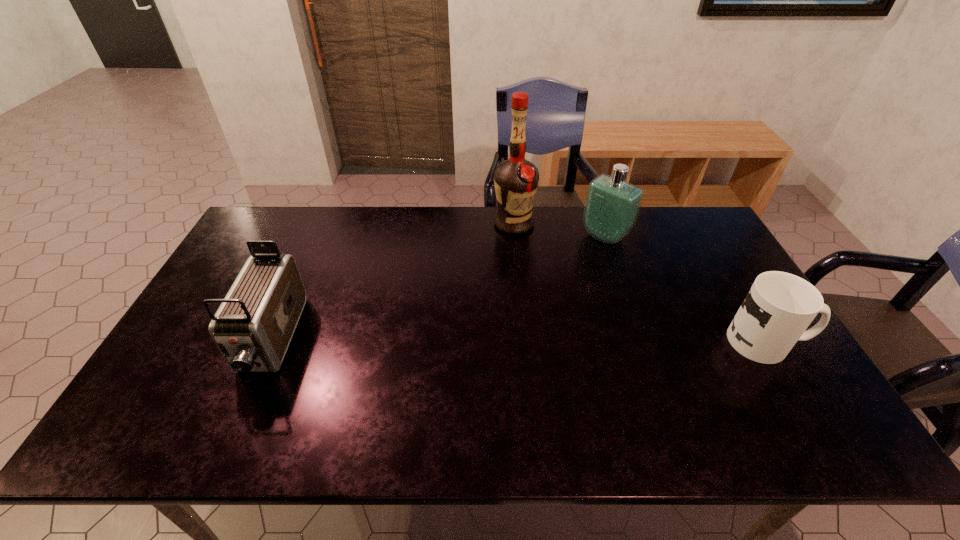
Identify the location of blank space located 0.290m on the front and back of the third object from right to left. (540, 296).

At what (x,y) coordinates should I click in order to perform the action: click on free region located on the front and back of the third object from right to left. Please return your answer as a coordinate pair (x, y). Image resolution: width=960 pixels, height=540 pixels. Looking at the image, I should click on (540, 298).

Where is `perfume situated at the far edge`? perfume situated at the far edge is located at coordinates (612, 205).

The image size is (960, 540). Identify the location of liquor that is positioned at the far edge. (516, 180).

In order to click on object present at the near edge in this screenshot , I will do `click(253, 327)`.

I want to click on object located at the right edge, so click(779, 307).

Find the location of `free space at the far edge`. free space at the far edge is located at coordinates (532, 235).

Image resolution: width=960 pixels, height=540 pixels. In the image, there is a desktop. In order to click on vacant space at the near edge in this screenshot , I will do `click(551, 388)`.

Image resolution: width=960 pixels, height=540 pixels. What are the coordinates of `vacant space at the left edge of the desktop` in the screenshot? It's located at (197, 334).

The height and width of the screenshot is (540, 960). Identify the location of blank area at the right edge. (690, 272).